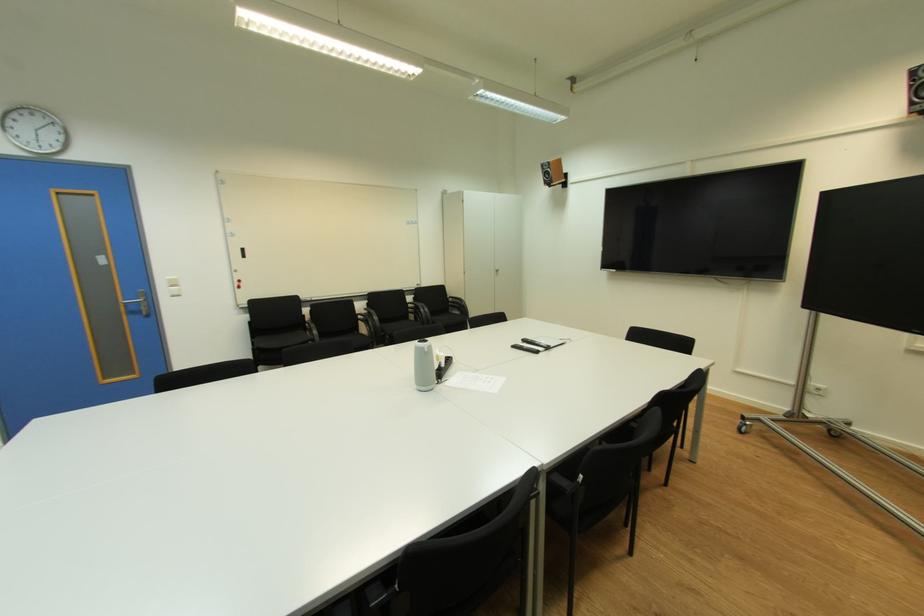
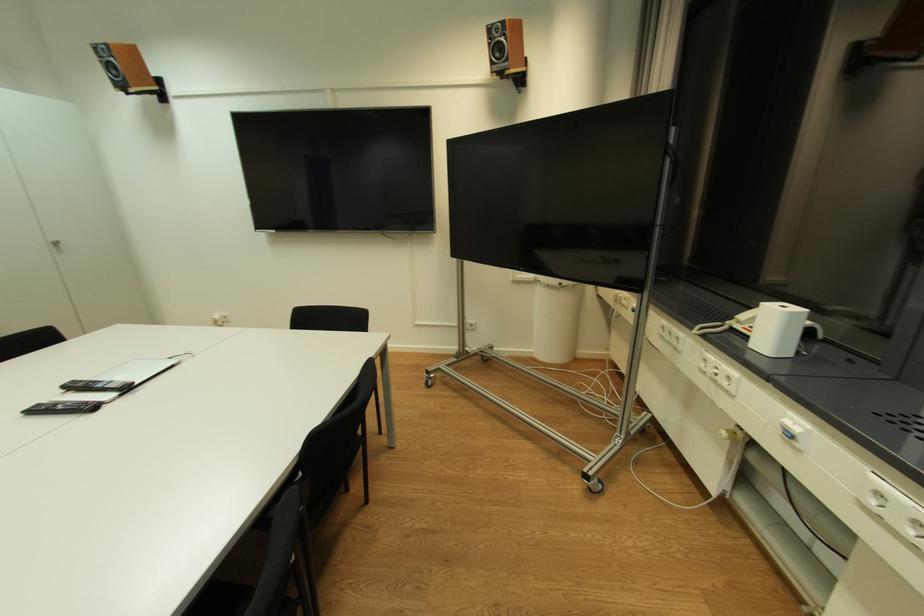
In the second image, find the point that corresponds to pixel 531 339 in the first image.

(79, 383)